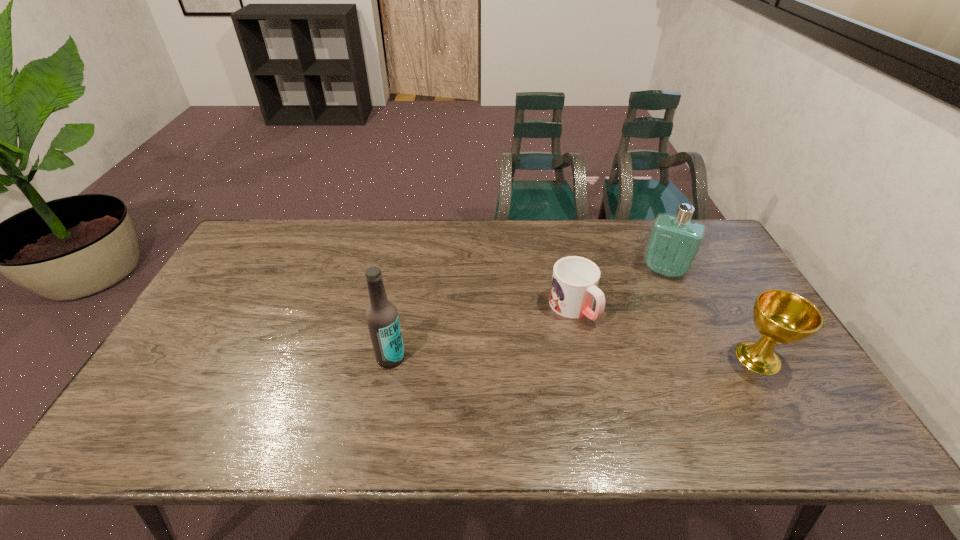
Where is `free location located 0.290m on the side of the third nearest object with the handle`? The width and height of the screenshot is (960, 540). free location located 0.290m on the side of the third nearest object with the handle is located at coordinates (667, 408).

Where is `vacant region located 0.360m on the front label of the second tallest object`? This screenshot has height=540, width=960. vacant region located 0.360m on the front label of the second tallest object is located at coordinates (623, 365).

Locate an element on the screen. The width and height of the screenshot is (960, 540). vacant region located on the front label of the second tallest object is located at coordinates (631, 347).

Locate an element on the screen. This screenshot has width=960, height=540. vacant space situated on the front label of the second tallest object is located at coordinates [x=638, y=329].

Where is `object that is at the far edge`? The width and height of the screenshot is (960, 540). object that is at the far edge is located at coordinates (674, 241).

Where is `object situated at the near edge`? Image resolution: width=960 pixels, height=540 pixels. object situated at the near edge is located at coordinates pyautogui.click(x=783, y=317).

Where is `chalice at the right edge`? The width and height of the screenshot is (960, 540). chalice at the right edge is located at coordinates (783, 317).

Locate an element on the screen. This screenshot has width=960, height=540. perfume situated at the right edge is located at coordinates (674, 241).

The image size is (960, 540). Identify the location of object that is at the far right corner. (674, 241).

Locate an element on the screen. Image resolution: width=960 pixels, height=540 pixels. object located in the near right corner section of the desktop is located at coordinates (783, 317).